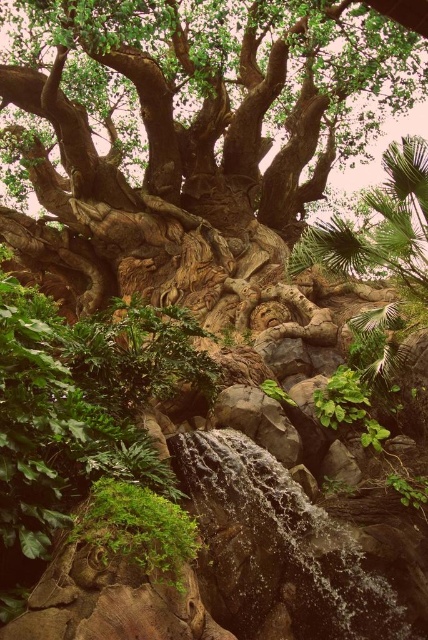
Between point (127, 540) and point (264, 438), which one is positioned in front?

Point (127, 540)

The height and width of the screenshot is (640, 428). Identify the location of green mossy rock at lower left. (136, 529).

Locate an element on the screen. green mossy rock at lower left is located at coordinates (136, 529).

Between clear water at center and green mossy rock at lower left, which one appears on the right side from the viewer's perspective?

clear water at center

Does clear water at center appear over green mossy rock at lower left?

No, clear water at center is not above green mossy rock at lower left.

Describe the element at coordinates (297, 548) in the screenshot. This screenshot has height=640, width=428. I see `clear water at center` at that location.

Image resolution: width=428 pixels, height=640 pixels. I want to click on clear water at center, so click(297, 548).

Looking at this image, is clear water at center further to the viewer compared to rocky waterfall at center?

No, clear water at center is in front of rocky waterfall at center.

Is clear water at center taller than rocky waterfall at center?

Yes, clear water at center is taller than rocky waterfall at center.

This screenshot has height=640, width=428. What are the coordinates of `clear water at center` in the screenshot? It's located at (297, 548).